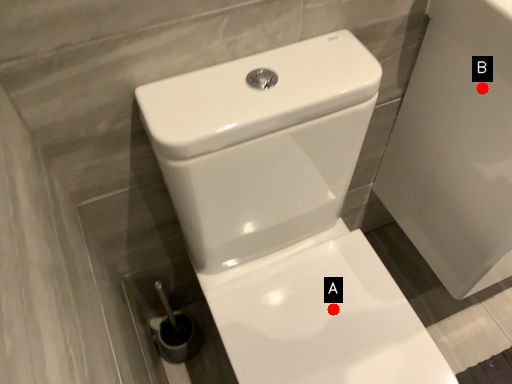
Question: Two points are circled on the image, labeled by A and B beside each circle. Among these points, which one is farthest from the camera?

Choices:
 (A) A is further
 (B) B is further

Answer: (A)